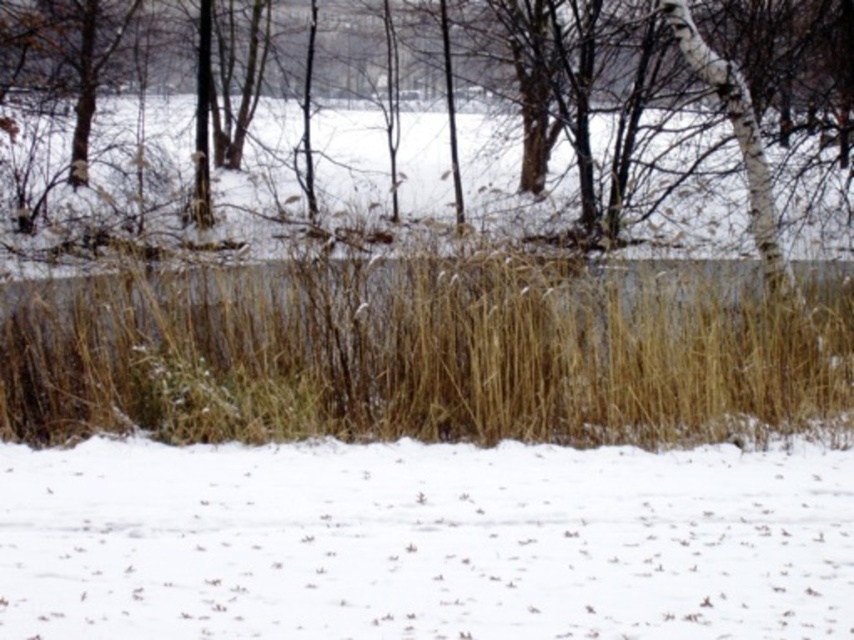
Question: Among these objects, which one is farthest from the camera?

Choices:
 (A) brown grass at center
 (B) white fluffy snow at lower center

Answer: (A)

Question: Can you confirm if white fluffy snow at lower center is positioned to the right of brown grass at center?

Choices:
 (A) yes
 (B) no

Answer: (A)

Question: Is white fluffy snow at lower center above brown grass at center?

Choices:
 (A) yes
 (B) no

Answer: (B)

Question: Is white fluffy snow at lower center above brown grass at center?

Choices:
 (A) no
 (B) yes

Answer: (A)

Question: Which point is closer to the camera?

Choices:
 (A) white fluffy snow at lower center
 (B) brown grass at center

Answer: (A)